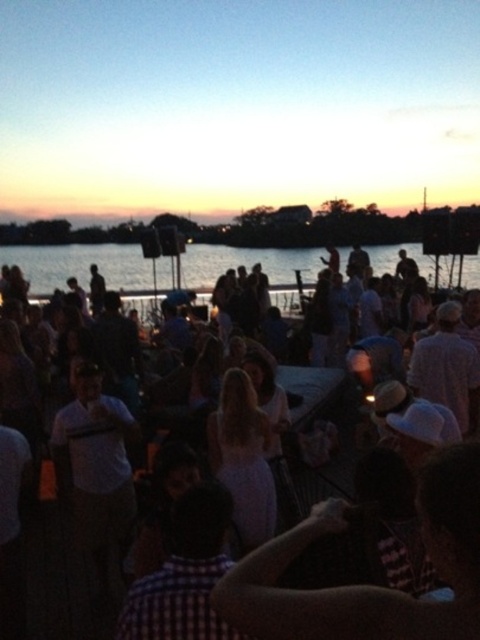
Between white cotton dress at center and blue water at center, which one appears on the right side from the viewer's perspective?

blue water at center is more to the right.

Between white cotton dress at center and blue water at center, which one has more height?

white cotton dress at center is taller.

Between point (382, 262) and point (162, 262), which one is positioned in front?

Point (162, 262)

Locate an element on the screen. Image resolution: width=480 pixels, height=640 pixels. white cotton dress at center is located at coordinates (446, 371).